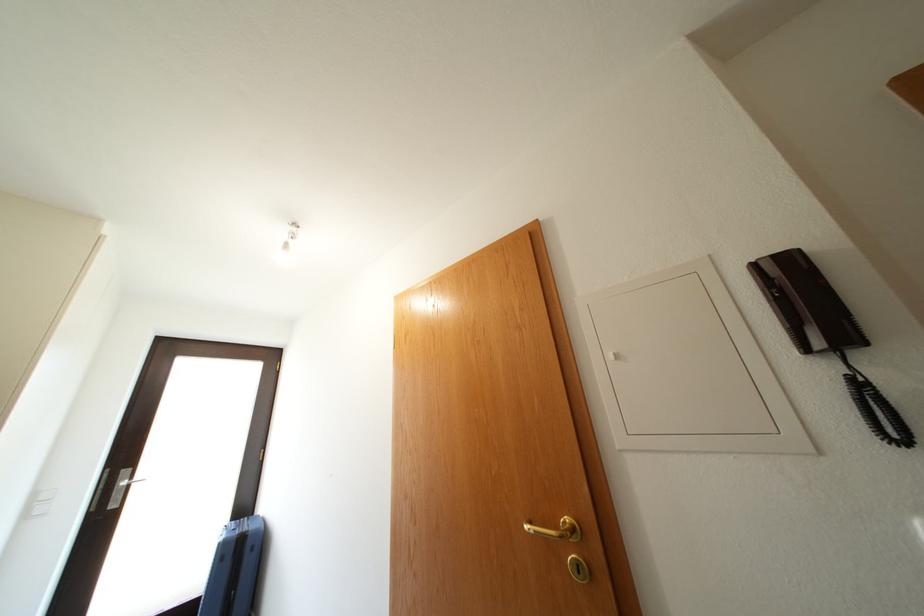
Where would you lift the black phone handset? Please return your answer as a coordinate pair (x, y).

(824, 331)